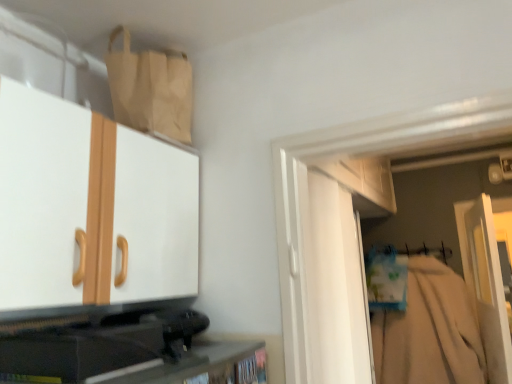
Question: Does matte white cabinet at upper left, the 1th cabinetry in the top-to-bottom sequence, appear on the right side of white matte door at center?

Choices:
 (A) no
 (B) yes

Answer: (A)

Question: From the image's perspective, is matte white cabinet at upper left, which ranks as the 2th cabinetry in bottom-to-top order, on white matte door at center?

Choices:
 (A) yes
 (B) no

Answer: (A)

Question: Is matte white cabinet at upper left, which ranks as the 2th cabinetry in bottom-to-top order, far away from white matte door at center?

Choices:
 (A) no
 (B) yes

Answer: (B)

Question: Is matte white cabinet at upper left, the 1th cabinetry in the top-to-bottom sequence, aimed at white matte door at center?

Choices:
 (A) no
 (B) yes

Answer: (A)

Question: Can white matte door at center be found inside matte white cabinet at upper left, which ranks as the 2th cabinetry in bottom-to-top order?

Choices:
 (A) yes
 (B) no

Answer: (B)

Question: From a real-world perspective, is matte white cabinet at upper left, which ranks as the 2th cabinetry in bottom-to-top order, under white matte door at center?

Choices:
 (A) no
 (B) yes

Answer: (A)

Question: Is matte white cabinet at upper left, which ranks as the 2th cabinetry in bottom-to-top order, facing away from matte beige paper bag at upper left?

Choices:
 (A) no
 (B) yes

Answer: (A)

Question: Does matte white cabinet at upper left, the 1th cabinetry in the top-to-bottom sequence, have a lesser height compared to matte beige paper bag at upper left?

Choices:
 (A) no
 (B) yes

Answer: (A)

Question: Is matte white cabinet at upper left, which ranks as the 2th cabinetry in bottom-to-top order, far from matte beige paper bag at upper left?

Choices:
 (A) no
 (B) yes

Answer: (A)

Question: Does matte white cabinet at upper left, which ranks as the 2th cabinetry in bottom-to-top order, lie in front of matte beige paper bag at upper left?

Choices:
 (A) yes
 (B) no

Answer: (A)

Question: Is matte white cabinet at upper left, the 1th cabinetry in the top-to-bottom sequence, smaller than matte beige paper bag at upper left?

Choices:
 (A) no
 (B) yes

Answer: (A)

Question: From a real-world perspective, is matte white cabinet at upper left, which ranks as the 2th cabinetry in bottom-to-top order, under matte beige paper bag at upper left?

Choices:
 (A) yes
 (B) no

Answer: (A)

Question: Can you confirm if beige cotton robe at right is bigger than white matte door at center?

Choices:
 (A) yes
 (B) no

Answer: (A)